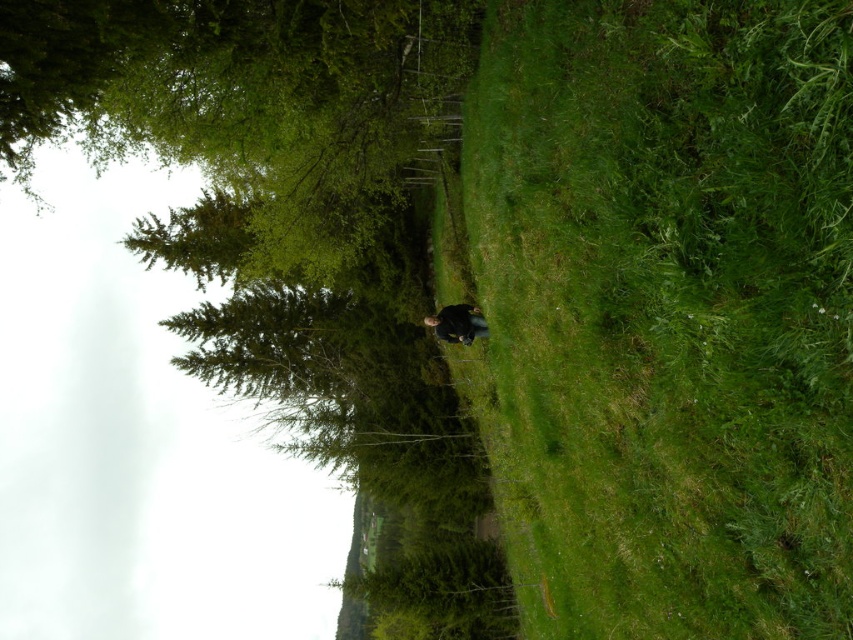
Question: Among these points, which one is farthest from the camera?

Choices:
 (A) (485, 179)
 (B) (213, 147)

Answer: (B)

Question: Is green grassy at center below dark blue jacket at center?

Choices:
 (A) yes
 (B) no

Answer: (A)

Question: Does green grassy at center have a larger size compared to dark blue jacket at center?

Choices:
 (A) no
 (B) yes

Answer: (B)

Question: Based on their relative distances, which object is nearer to the green leafy tree at upper left?

Choices:
 (A) dark blue jacket at center
 (B) green grassy at center

Answer: (B)

Question: Which point is closer to the camera?

Choices:
 (A) (657, 301)
 (B) (453, 307)
 (C) (200, 22)

Answer: (A)

Question: Is green grassy at center below dark blue jacket at center?

Choices:
 (A) no
 (B) yes

Answer: (B)